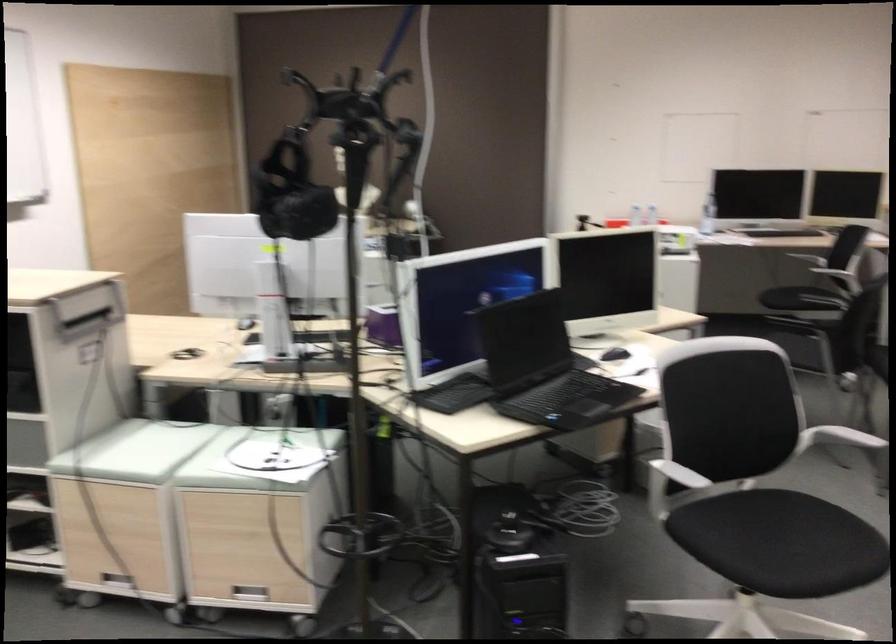
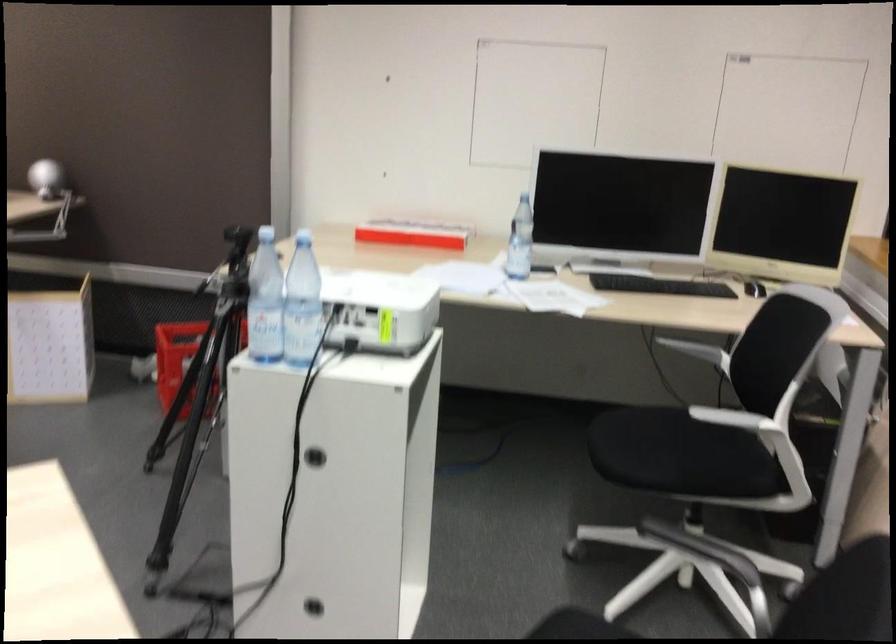
Question: I am providing you with two images of the same scene from different viewpoints. After the viewpoint changes to image2, which objects are now occluded?

Choices:
 (A) cabinet hole handle
 (B) long red box
 (C) small printer lid
 (D) black chair sitting surface

Answer: (D)